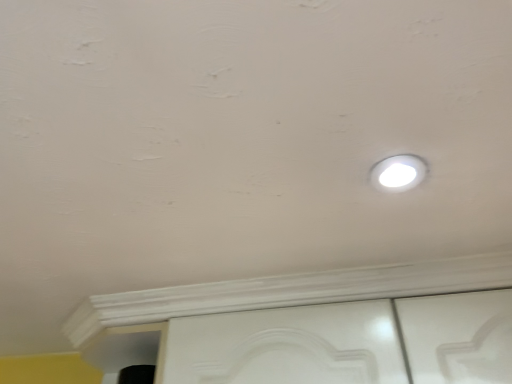
Where is `white glossy light fixture at upper right`? white glossy light fixture at upper right is located at coordinates (398, 173).

The width and height of the screenshot is (512, 384). What do you see at coordinates (398, 173) in the screenshot? I see `white glossy light fixture at upper right` at bounding box center [398, 173].

Where is `white glossy light fixture at upper right`? white glossy light fixture at upper right is located at coordinates (398, 173).